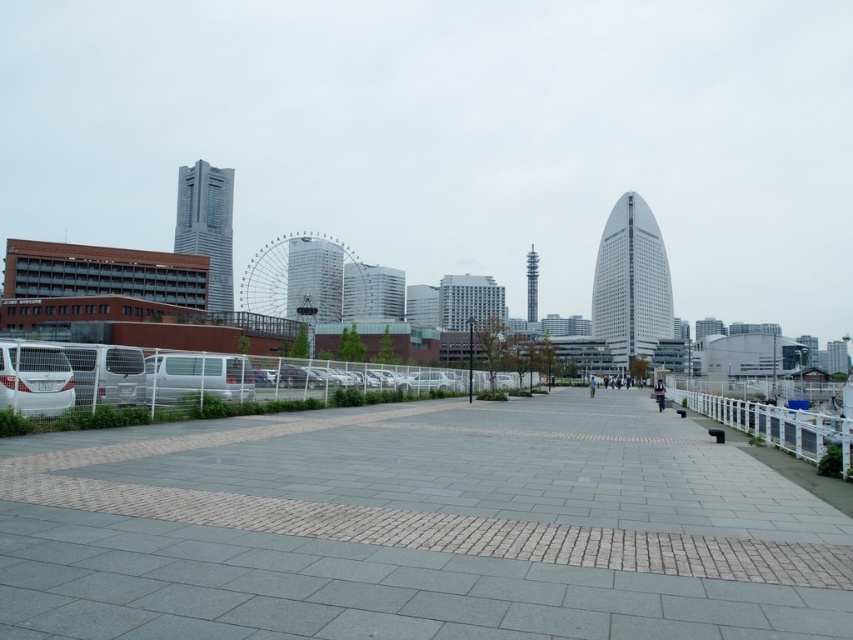
You are a delivery person standing on the gray concrete pavement at center. You need to place a package on the white plastic rail at lower right. Can you reach it without moving from your current position?

The gray concrete pavement at center is located above the white plastic rail at lower right, so you cannot reach it from your current position without moving.

You are a delivery person with a cart that is 2 meters wide. You need to move from the gray concrete pavement at center to the white plastic rail at lower right. Is there enough space between them for your cart to pass through?

The distance between the gray concrete pavement at center and the white plastic rail at lower right is 6.26 meters. Since your cart is only 2 meters wide, there is sufficient space for it to pass through comfortably.

Looking at this image, you are standing at the edge of the walkway in the urban waterfront scene. There is a gray concrete pavement at center marked by point (416, 529). If you walk straight ahead, will you reach the parking area before the white metal fence?

The point (416, 529) indicates the gray concrete pavement at center. Since the white metal fence is parallel to the walkway and separates it from the parking area, walking straight ahead from the walkway would lead you toward the fence first before reaching the parking area. Therefore, you would reach the white metal fence before the parking area.